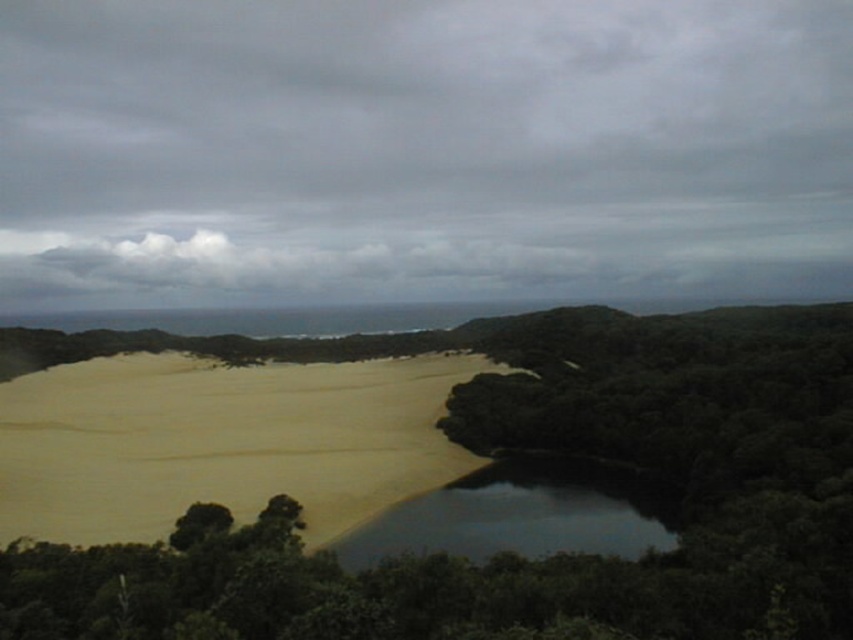
Between gray cloudy sky at upper center and sandy yellow at lower left, which one is positioned lower?

sandy yellow at lower left is lower down.

Which is more to the right, gray cloudy sky at upper center or sandy yellow at lower left?

From the viewer's perspective, gray cloudy sky at upper center appears more on the right side.

This screenshot has width=853, height=640. Describe the element at coordinates (421, 148) in the screenshot. I see `gray cloudy sky at upper center` at that location.

This screenshot has height=640, width=853. In order to click on gray cloudy sky at upper center in this screenshot , I will do pos(421,148).

Does dark reflective water at center have a greater height compared to green leafy tree at lower left?

Correct, dark reflective water at center is much taller as green leafy tree at lower left.

Identify the location of dark reflective water at center. The width and height of the screenshot is (853, 640). (523, 513).

The image size is (853, 640). Find the location of `dark reflective water at center`. dark reflective water at center is located at coordinates (523, 513).

Is gray cloudy sky at upper center below dark reflective water at center?

Incorrect, gray cloudy sky at upper center is not positioned below dark reflective water at center.

Is point (601, 80) positioned behind point (537, 477)?

That is True.

Where is `gray cloudy sky at upper center`? The height and width of the screenshot is (640, 853). gray cloudy sky at upper center is located at coordinates (421, 148).